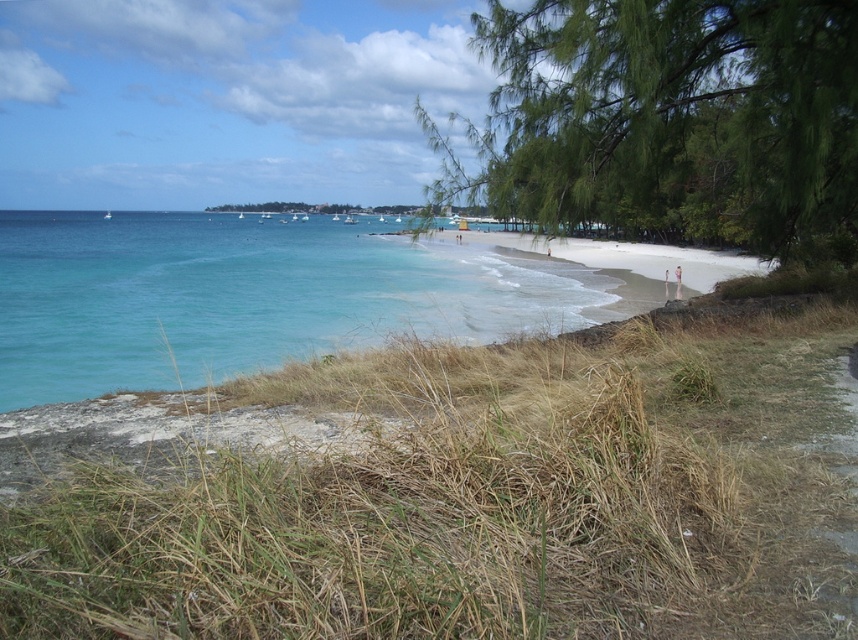
Who is shorter, green leafy tree at upper right or turquoise water at left?

turquoise water at left is shorter.

Does point (644, 134) lie behind point (69, 321)?

No.

This screenshot has width=858, height=640. Find the location of `green leafy tree at upper right`. green leafy tree at upper right is located at coordinates (669, 120).